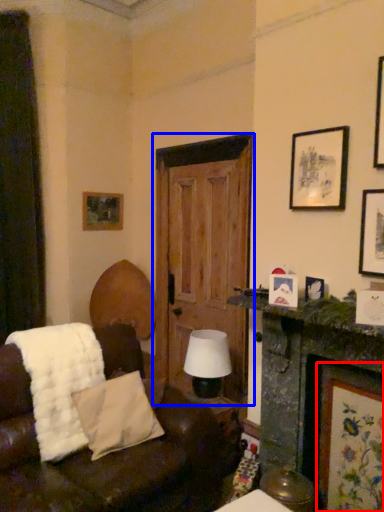
Question: Among these objects, which one is nearest to the camera, picture frame (highlighted by a red box) or door (highlighted by a blue box)?

Choices:
 (A) picture frame
 (B) door

Answer: (A)